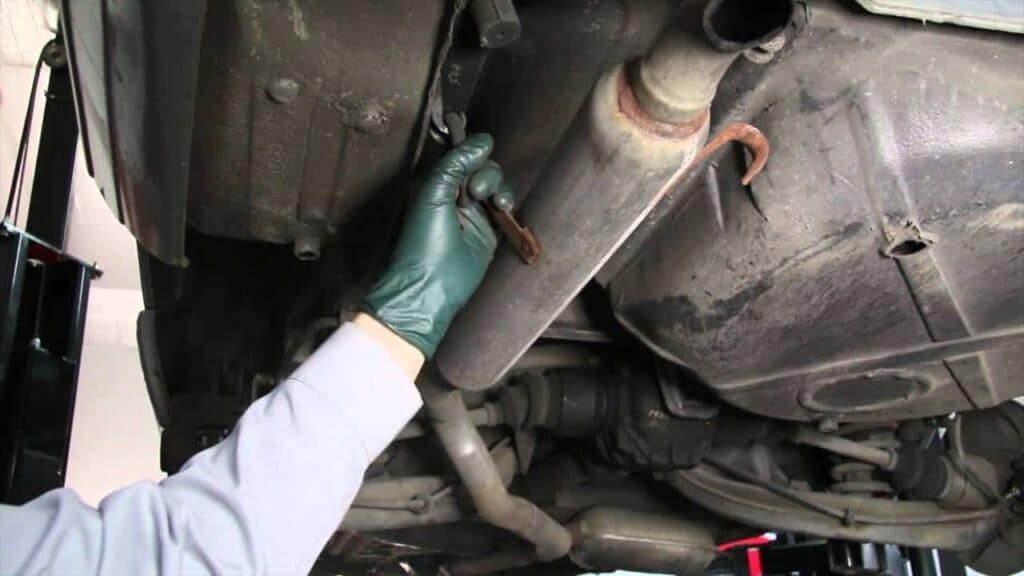
The height and width of the screenshot is (576, 1024). What are the coordinates of `hooks` in the screenshot? It's located at (742, 176), (466, 116).